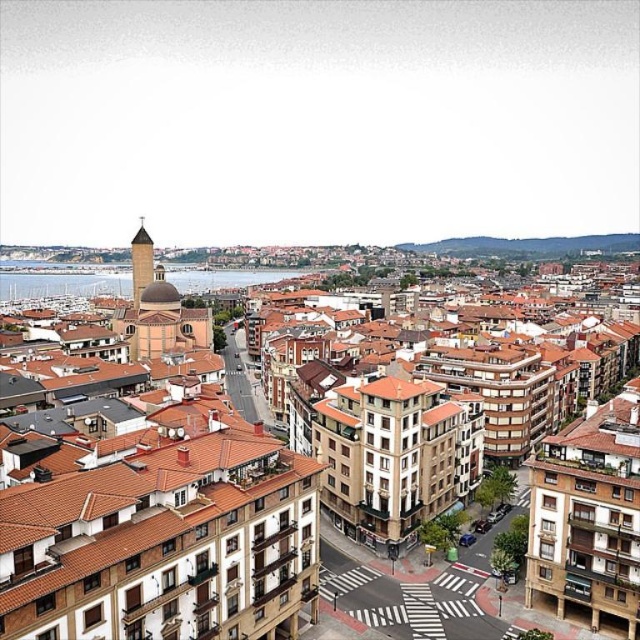
Question: Is blue water at center behind smooth stone bell tower at upper center?

Choices:
 (A) yes
 (B) no

Answer: (A)

Question: Which point appears farthest from the camera in this image?

Choices:
 (A) (134, 298)
 (B) (19, 513)
 (C) (188, 276)

Answer: (C)

Question: Considering the real-world distances, which object is farthest from the blue water at center?

Choices:
 (A) smooth stone bell tower at upper center
 (B) brown brick building at center

Answer: (B)

Question: Which of the following is the closest to the observer?

Choices:
 (A) (140, 268)
 (B) (134, 499)
 (C) (52, 289)

Answer: (B)

Question: Does brown brick building at center have a greater width compared to smooth stone bell tower at upper center?

Choices:
 (A) yes
 (B) no

Answer: (A)

Question: Where is brown brick building at center located in relation to blue water at center in the image?

Choices:
 (A) above
 (B) below

Answer: (B)